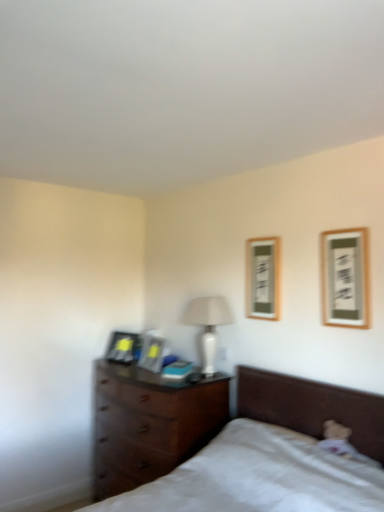
Question: From a real-world perspective, is matte black picture frame at left, which ranks as the 1th picture frame in left-to-right order, physically below matte black picture frame at center, which is the 3th picture frame in front-to-back order?

Choices:
 (A) yes
 (B) no

Answer: (A)

Question: Does matte black picture frame at left, which ranks as the 1th picture frame in left-to-right order, have a lesser width compared to matte black picture frame at center, which is the 2th picture frame from left to right?

Choices:
 (A) yes
 (B) no

Answer: (B)

Question: From the image's perspective, is matte black picture frame at left, the 4th picture frame from the front, over matte black picture frame at center, acting as the third picture frame starting from the right?

Choices:
 (A) no
 (B) yes

Answer: (A)

Question: Does matte black picture frame at left, the 4th picture frame from the front, have a greater width compared to matte black picture frame at center, which is the 3th picture frame in front-to-back order?

Choices:
 (A) yes
 (B) no

Answer: (A)

Question: Is matte black picture frame at left, the 4th picture frame from the front, to the right of matte black picture frame at center, which appears as the second picture frame when viewed from the back, from the viewer's perspective?

Choices:
 (A) no
 (B) yes

Answer: (A)

Question: From a real-world perspective, is white glossy table lamp at center physically located above or below matte black picture frame at center, which appears as the second picture frame when viewed from the back?

Choices:
 (A) below
 (B) above

Answer: (B)

Question: Is point (195, 309) positioned closer to the camera than point (160, 362)?

Choices:
 (A) closer
 (B) farther

Answer: (A)

Question: Is white glossy table lamp at center in front of or behind matte black picture frame at center, which is the 2th picture frame from left to right, in the image?

Choices:
 (A) front
 (B) behind

Answer: (A)

Question: Is white glossy table lamp at center wider or thinner than matte black picture frame at center, which appears as the second picture frame when viewed from the back?

Choices:
 (A) thin
 (B) wide

Answer: (B)

Question: Visually, is dark wood chest of drawers at lower left positioned to the left or to the right of matte black picture frame at center, acting as the third picture frame starting from the right?

Choices:
 (A) left
 (B) right

Answer: (B)

Question: From the image's perspective, is dark wood chest of drawers at lower left positioned above or below matte black picture frame at center, which is the 2th picture frame from left to right?

Choices:
 (A) above
 (B) below

Answer: (B)

Question: Considering the positions of dark wood chest of drawers at lower left and matte black picture frame at center, which appears as the second picture frame when viewed from the back, in the image, is dark wood chest of drawers at lower left wider or thinner than matte black picture frame at center, which appears as the second picture frame when viewed from the back,?

Choices:
 (A) wide
 (B) thin

Answer: (A)

Question: Considering the positions of dark wood chest of drawers at lower left and matte black picture frame at center, which is the 3th picture frame in front-to-back order, in the image, is dark wood chest of drawers at lower left taller or shorter than matte black picture frame at center, which is the 3th picture frame in front-to-back order,?

Choices:
 (A) tall
 (B) short

Answer: (A)

Question: Is dark wood chest of drawers at lower left in front of or behind wooden framed picture at upper right, the 1th picture frame in the right-to-left sequence, in the image?

Choices:
 (A) front
 (B) behind

Answer: (B)

Question: Looking at their shapes, would you say dark wood chest of drawers at lower left is wider or thinner than wooden framed picture at upper right, the first picture frame from the front?

Choices:
 (A) thin
 (B) wide

Answer: (B)